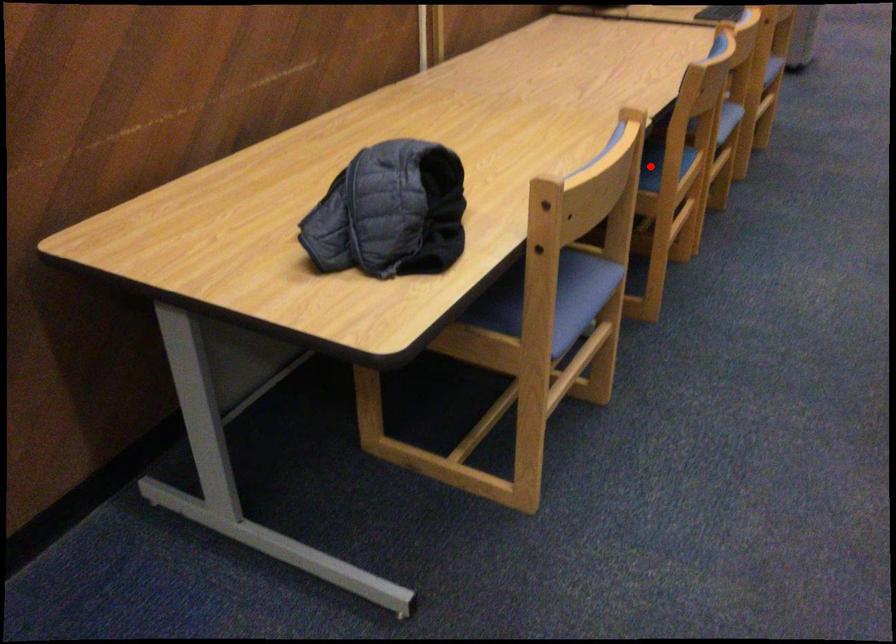
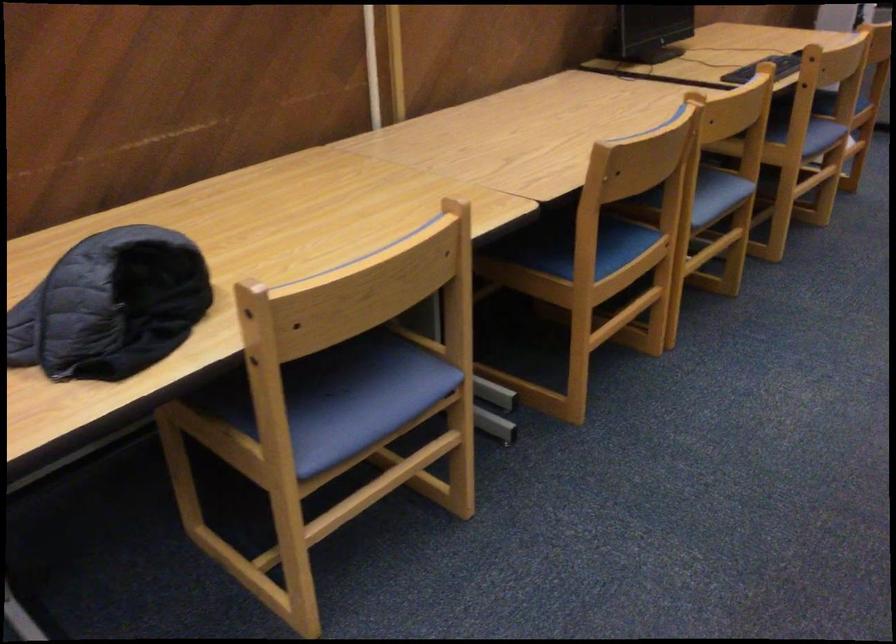
Question: I am providing you with two images of the same scene from different viewpoints. Given a red point in image1, look at the same physical point in image2. Is it:

Choices:
 (A) Closer to the viewpoint
 (B) Farther from the viewpoint

Answer: (A)